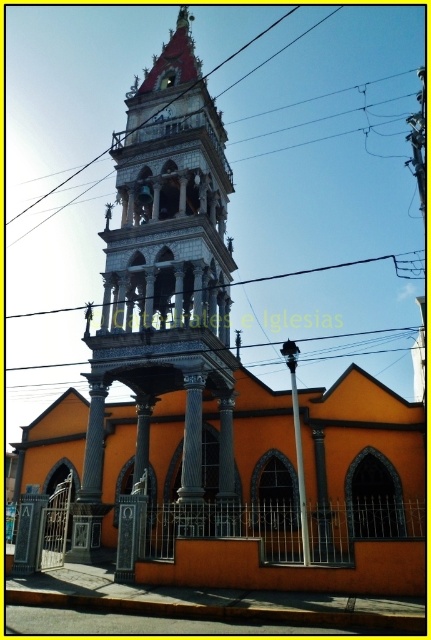
Is polished stone pillar at center bigger than metallic wire at upper center?

No, polished stone pillar at center is not bigger than metallic wire at upper center.

Find the location of a particular element. This screenshot has width=431, height=640. polished stone pillar at center is located at coordinates (28, 532).

Identify the location of polished stone pillar at center. (28, 532).

Measure the distance from white marble tower at center to metallic wire at upper center.

They are 22.75 meters apart.

Locate an element on the screen. white marble tower at center is located at coordinates (165, 285).

Image resolution: width=431 pixels, height=640 pixels. I want to click on white marble tower at center, so click(x=165, y=285).

Identify the location of white marble tower at center. (165, 285).

Consider the image. Is white marble tower at center closer to the viewer compared to polished stone pillar at center?

Yes, it is in front of polished stone pillar at center.

Who is more forward, (x=143, y=419) or (x=24, y=557)?

Point (x=24, y=557)

This screenshot has width=431, height=640. I want to click on white marble tower at center, so click(x=165, y=285).